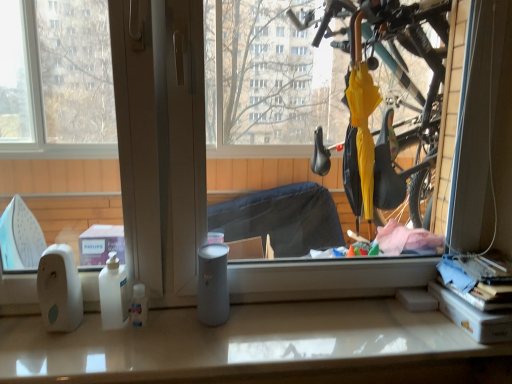
Question: From the image's perspective, relative to white glossy counter top at lower center, is transparent plastic umbrella at center above or below?

Choices:
 (A) above
 (B) below

Answer: (A)

Question: Considering the relative positions of transparent plastic umbrella at center and white glossy counter top at lower center in the image provided, is transparent plastic umbrella at center to the left or to the right of white glossy counter top at lower center?

Choices:
 (A) right
 (B) left

Answer: (A)

Question: Is transparent plastic umbrella at center spatially inside white glossy counter top at lower center, or outside of it?

Choices:
 (A) outside
 (B) inside

Answer: (A)

Question: From a real-world perspective, is white glossy counter top at lower center positioned above or below transparent plastic umbrella at center?

Choices:
 (A) below
 (B) above

Answer: (A)

Question: Choose the correct answer: Is white glossy counter top at lower center inside transparent plastic umbrella at center or outside it?

Choices:
 (A) outside
 (B) inside

Answer: (A)

Question: Is white glossy counter top at lower center taller or shorter than transparent plastic umbrella at center?

Choices:
 (A) tall
 (B) short

Answer: (B)

Question: Is white glossy counter top at lower center bigger or smaller than transparent plastic umbrella at center?

Choices:
 (A) small
 (B) big

Answer: (A)